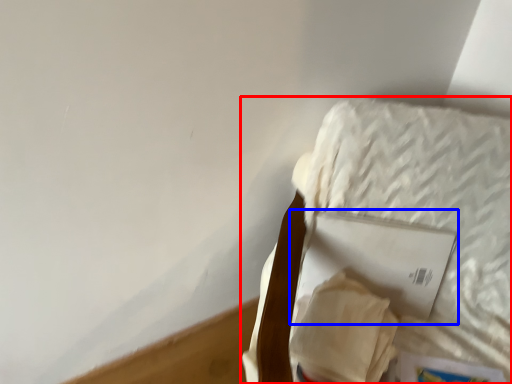
Question: Which object appears closest to the camera in this image, furniture (highlighted by a red box) or paperback book (highlighted by a blue box)?

Choices:
 (A) furniture
 (B) paperback book

Answer: (A)